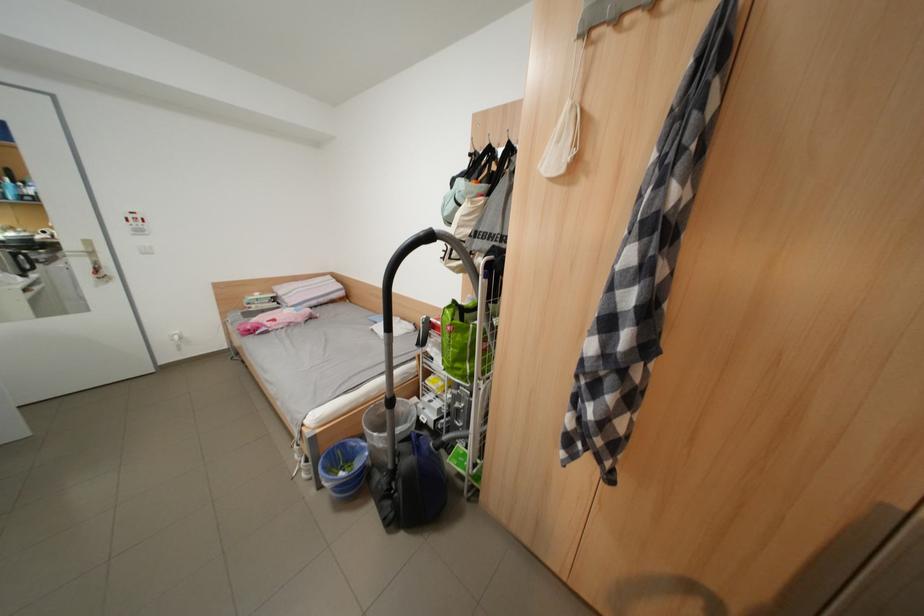
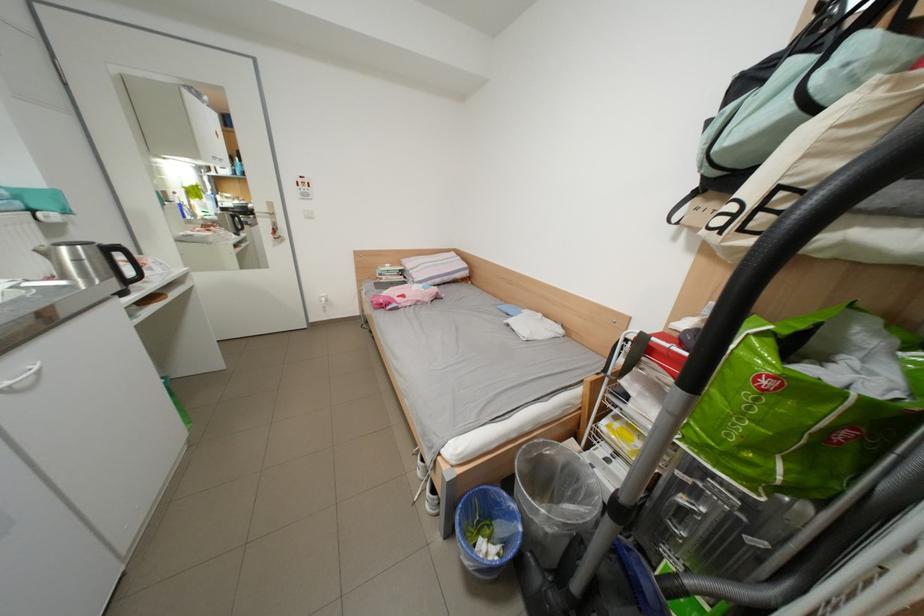
In the second image, find the point that corresponds to (365,448) in the first image.

(509, 506)